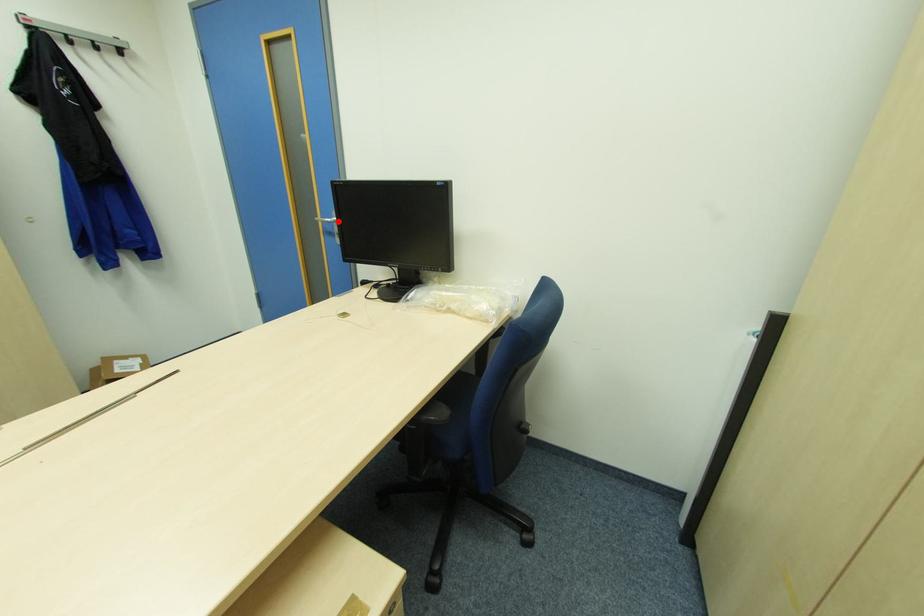
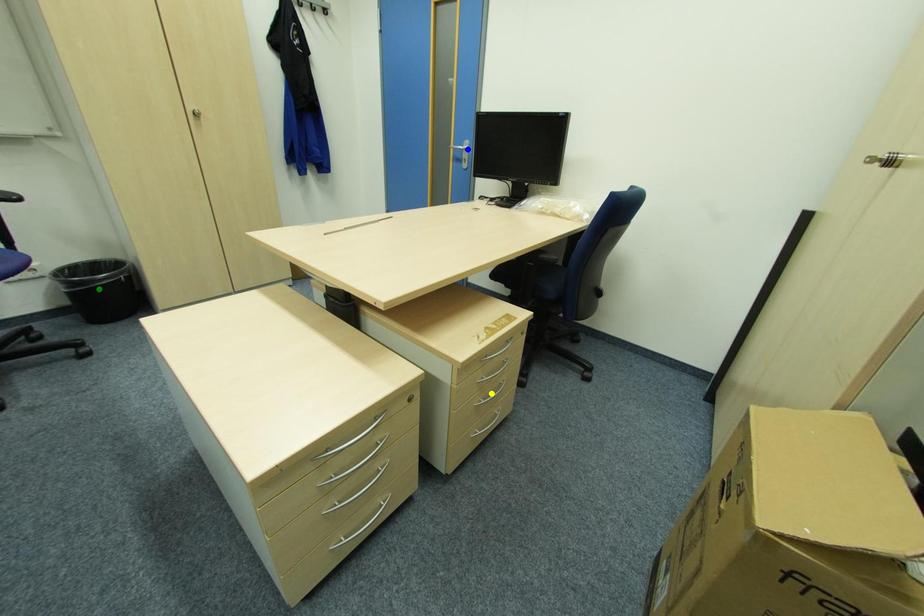
Question: I am providing you with two images of the same scene from different viewpoints. A red point is marked on the first image. You are given multiple points on the second image. Which point in image 2 is actually the same real-world point as the red point in image 1?

Choices:
 (A) yellow point
 (B) green point
 (C) blue point

Answer: (C)